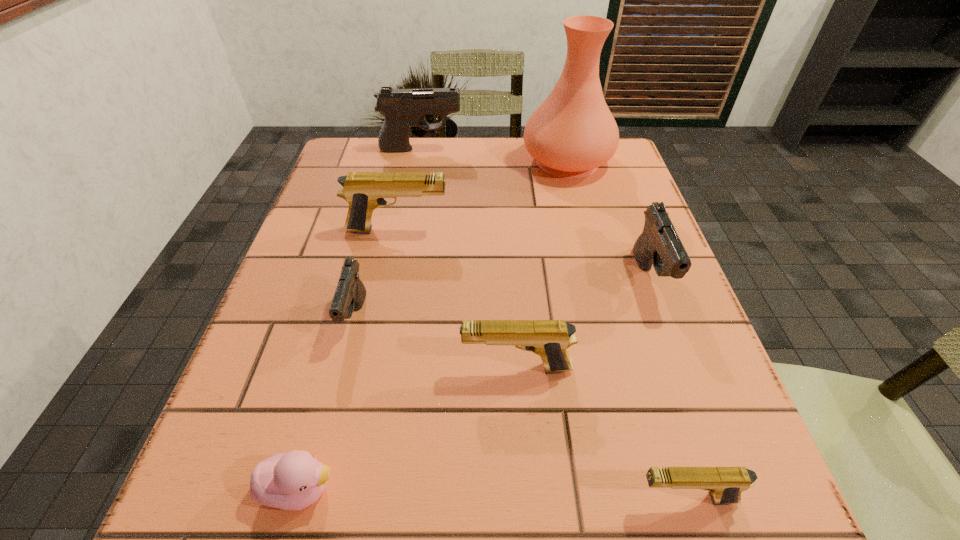
Select which object appears as the fourth closest to the tallest object. Please provide its 2D coordinates. Your answer should be formatted as a tuple, i.e. [(x, y)], where the tuple contains the x and y coordinates of a point satisfying the conditions above.

[(350, 294)]

This screenshot has height=540, width=960. Identify the location of pistol that is the fifth closest to the biggest black pistol. (725, 484).

Locate which pistol is the second closest to the tallest pistol. Please provide its 2D coordinates. Your answer should be formatted as a tuple, i.e. [(x, y)], where the tuple contains the x and y coordinates of a point satisfying the conditions above.

[(350, 294)]

Where is `black pistol that stands as the closest to the smallest black pistol`? black pistol that stands as the closest to the smallest black pistol is located at coordinates (402, 108).

The width and height of the screenshot is (960, 540). Find the location of `the third closest black pistol relative to the third nearest object`. the third closest black pistol relative to the third nearest object is located at coordinates (402, 108).

Identify which tan pistol is the nearest to the pink duckling. Please provide its 2D coordinates. Your answer should be formatted as a tuple, i.e. [(x, y)], where the tuple contains the x and y coordinates of a point satisfying the conditions above.

[(549, 339)]

Where is `tan pistol that is the closest one to the smallest black pistol`? The image size is (960, 540). tan pistol that is the closest one to the smallest black pistol is located at coordinates (364, 191).

Where is `free location that satisfies the following two spatial constraints: 1. at the barrel of the second biggest black pistol; 2. at the barrel of the smallest tan pistol`? The image size is (960, 540). free location that satisfies the following two spatial constraints: 1. at the barrel of the second biggest black pistol; 2. at the barrel of the smallest tan pistol is located at coordinates (732, 498).